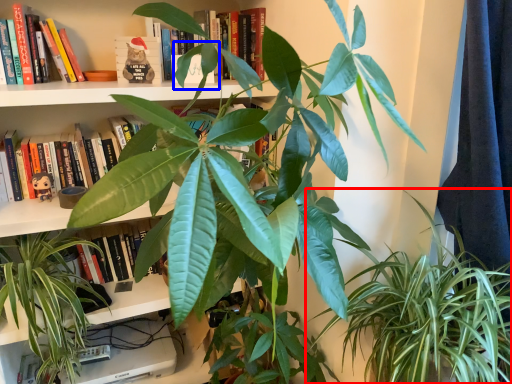
Question: Which object is further to the camera taking this photo, houseplant (highlighted by a red box) or leaf (highlighted by a blue box)?

Choices:
 (A) houseplant
 (B) leaf

Answer: (B)